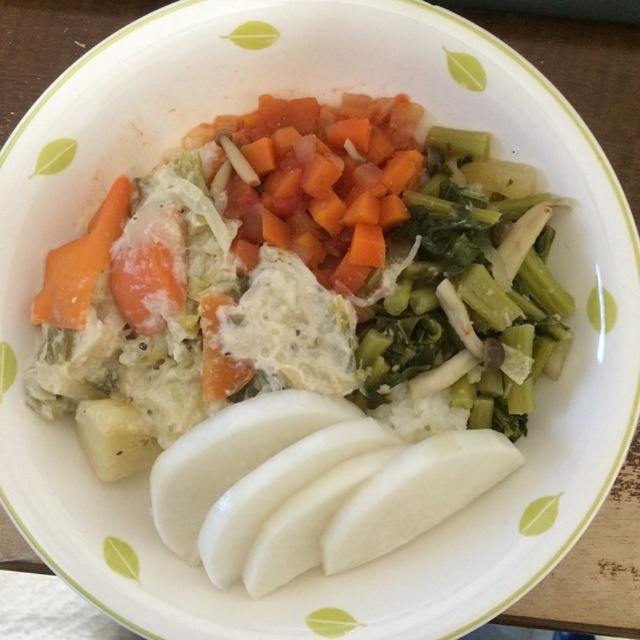
Question: Estimate the real-world distances between objects in this image. Which object is closer to the diced orange carrot at center?

Choices:
 (A) green leafy vegetable at center
 (B) orange matte carrot at left

Answer: (A)

Question: Can you confirm if green leafy vegetable at center is wider than orange matte carrot at left?

Choices:
 (A) yes
 (B) no

Answer: (A)

Question: Observing the image, what is the correct spatial positioning of diced orange carrot at center in reference to orange matte carrot at left?

Choices:
 (A) right
 (B) left

Answer: (A)

Question: Which object is positioned farthest from the diced orange carrot at center?

Choices:
 (A) green leafy vegetable at center
 (B) orange matte carrot at left

Answer: (B)

Question: Which point is farther to the camera?

Choices:
 (A) orange matte carrot at left
 (B) green leafy vegetable at center

Answer: (B)

Question: Is diced orange carrot at center wider than orange matte carrot at left?

Choices:
 (A) no
 (B) yes

Answer: (B)